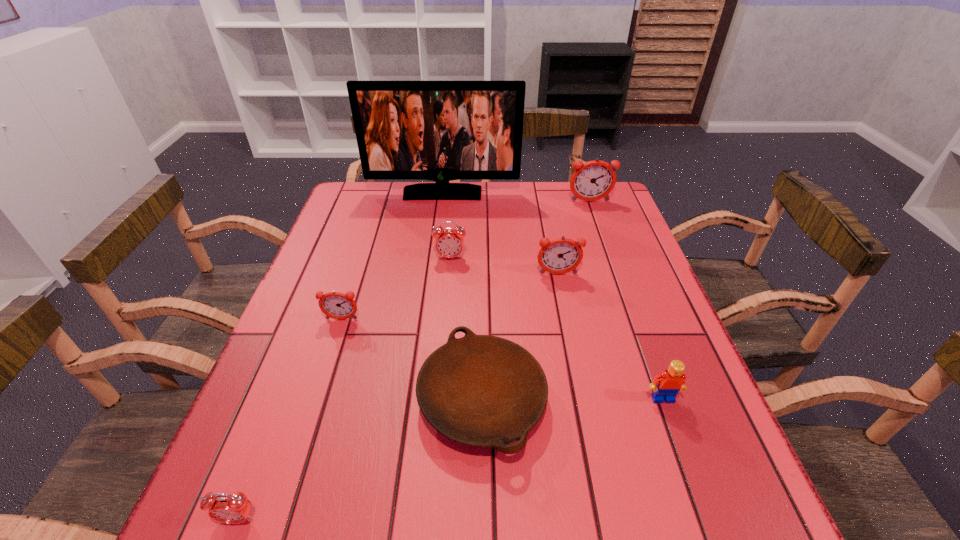
Where is `vacant space located on the left of the brown plate`? The height and width of the screenshot is (540, 960). vacant space located on the left of the brown plate is located at coordinates (388, 399).

Find the location of a particular element. The height and width of the screenshot is (540, 960). monitor present at the far edge is located at coordinates (441, 131).

Where is `alarm clock that is at the far edge`? Image resolution: width=960 pixels, height=540 pixels. alarm clock that is at the far edge is located at coordinates (593, 180).

The width and height of the screenshot is (960, 540). In order to click on object present at the near edge in this screenshot , I will do `click(231, 509)`.

The height and width of the screenshot is (540, 960). In order to click on monitor located in the left edge section of the desktop in this screenshot , I will do (x=441, y=131).

Find the location of `alarm clock that is positioned at the right edge`. alarm clock that is positioned at the right edge is located at coordinates pyautogui.click(x=593, y=180).

Find the location of a particular element. Lego that is at the right edge is located at coordinates (671, 381).

Where is `object at the far left corner`? object at the far left corner is located at coordinates (441, 131).

This screenshot has width=960, height=540. Find the location of `object located at the near left corner`. object located at the near left corner is located at coordinates (231, 509).

The width and height of the screenshot is (960, 540). I want to click on object situated at the far right corner, so click(x=593, y=180).